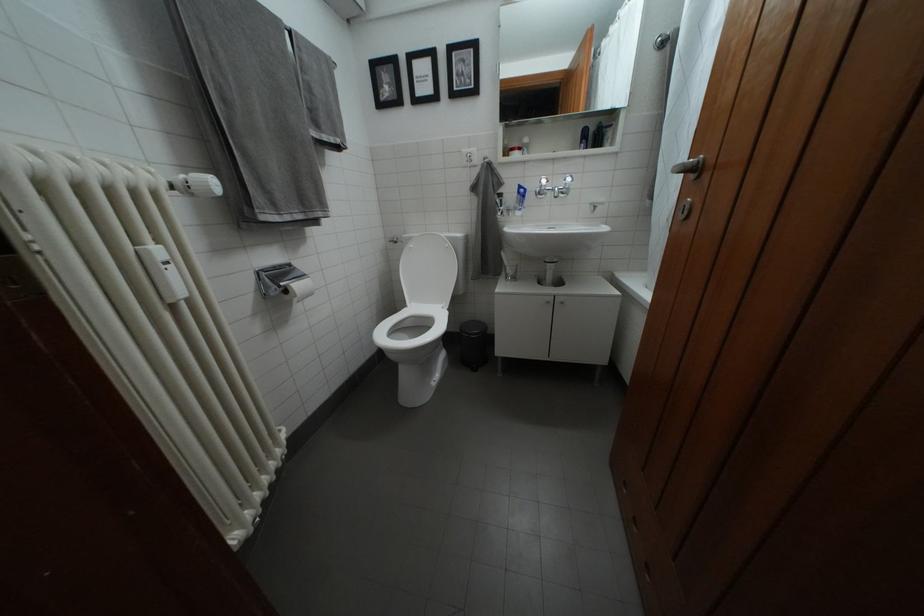
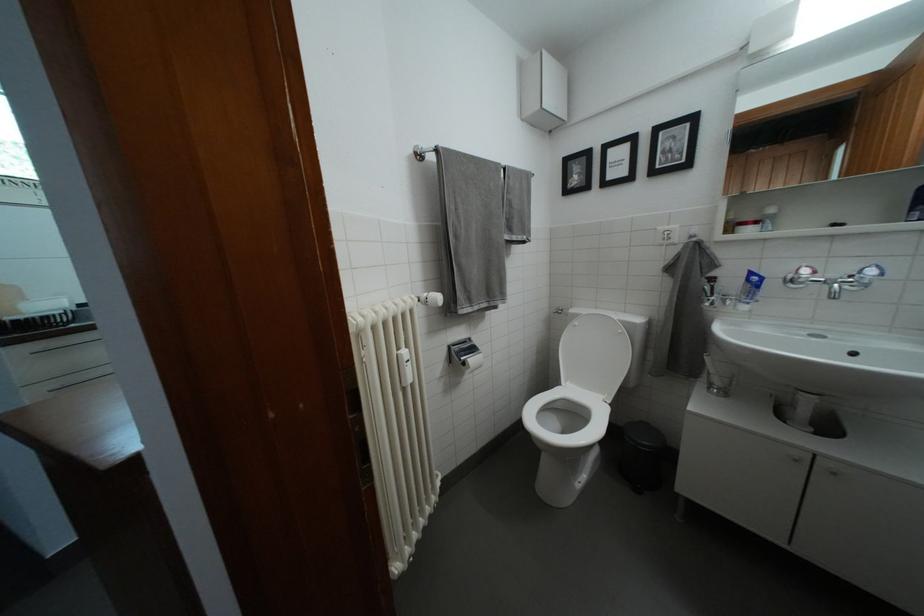
Find the pixel in the second image that matches point 513,278 in the first image.

(714, 382)